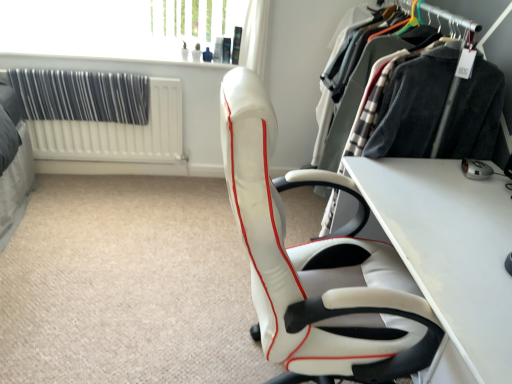
You are a GUI agent. You are given a task and a screenshot of the screen. Output one action in this format:
    pyautogui.click(x=<x>, y=<y>)
    Task: Click on the free space to the left of silver metallic mouse at lower right
    The image size is (512, 384).
    Given the screenshot: What is the action you would take?
    pyautogui.click(x=435, y=173)